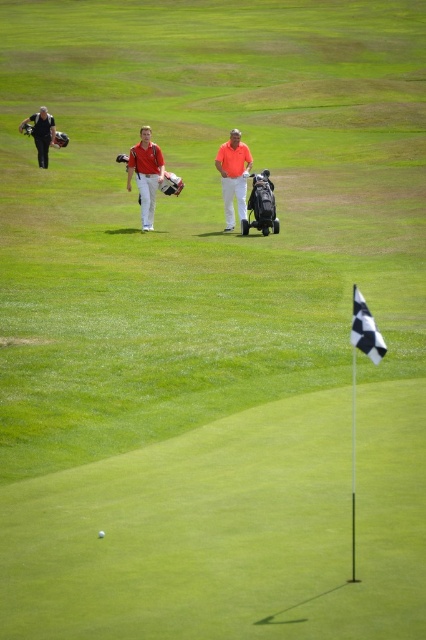
You are standing at the golf hole with the checkered flag and want to find the golfer wearing the matte orange shirt at center. According to the scene description, where should you look?

The matte orange shirt at center is located at point [233,176] in the scene.